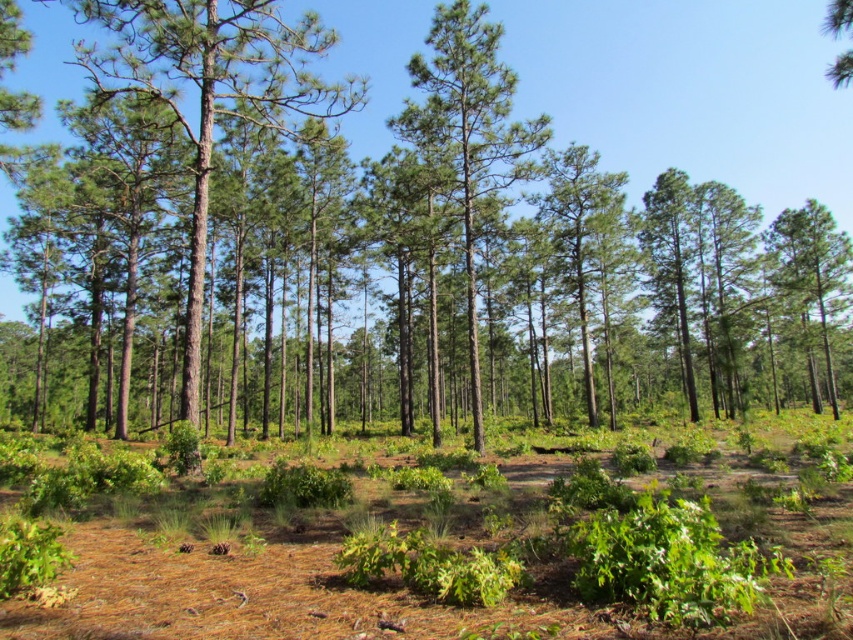
Who is positioned more to the left, green textured tree at center or green matte tree at right?

From the viewer's perspective, green matte tree at right appears more on the left side.

Consider the image. Between green textured tree at center and green matte tree at right, which one appears on the right side from the viewer's perspective?

From the viewer's perspective, green textured tree at center appears more on the right side.

The image size is (853, 640). In order to click on green textured tree at center in this screenshot , I will do `click(691, 92)`.

Does green textured tree at center have a larger size compared to green rough bark tree at center?

Indeed, green textured tree at center has a larger size compared to green rough bark tree at center.

Is green textured tree at center smaller than green rough bark tree at center?

Incorrect, green textured tree at center is not smaller in size than green rough bark tree at center.

Image resolution: width=853 pixels, height=640 pixels. Identify the location of green textured tree at center. (691, 92).

What do you see at coordinates (468, 132) in the screenshot? Image resolution: width=853 pixels, height=640 pixels. I see `green matte tree at center` at bounding box center [468, 132].

Does green matte tree at center have a smaller size compared to green matte tree at right?

Yes.

Identify the location of green matte tree at center. (468, 132).

You are a GUI agent. You are given a task and a screenshot of the screen. Output one action in this format:
    pyautogui.click(x=<x>, y=<y>)
    Task: Click on the green matte tree at center
    
    Given the screenshot: What is the action you would take?
    pyautogui.click(x=468, y=132)